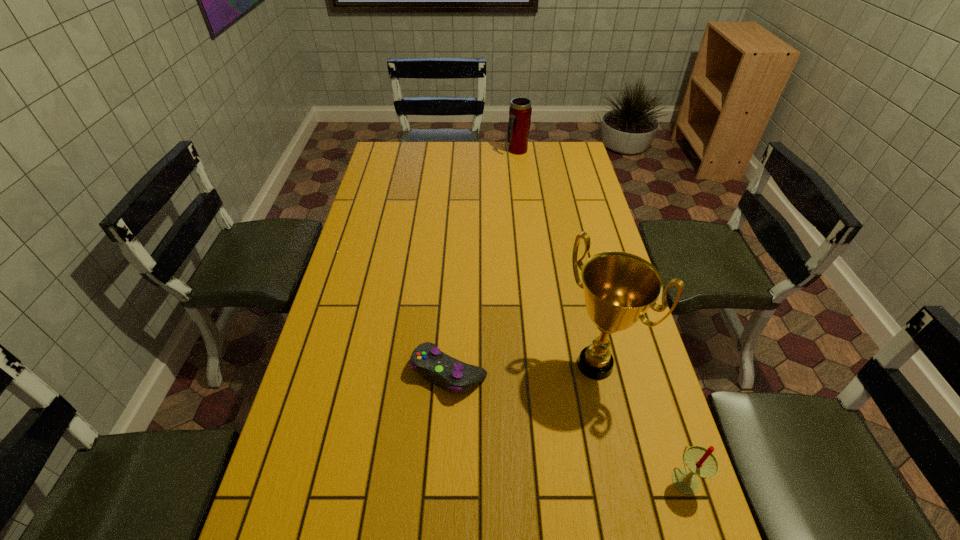
Identify the location of free space on the desktop that is between the control and the nearest object and is positioned on the side with the handle of the thermos bottle. This screenshot has width=960, height=540. (567, 425).

In order to click on vacant space on the desktop that is between the shortest object and the nearest object and is positioned on the front view with handles of the award in this screenshot , I will do click(x=550, y=417).